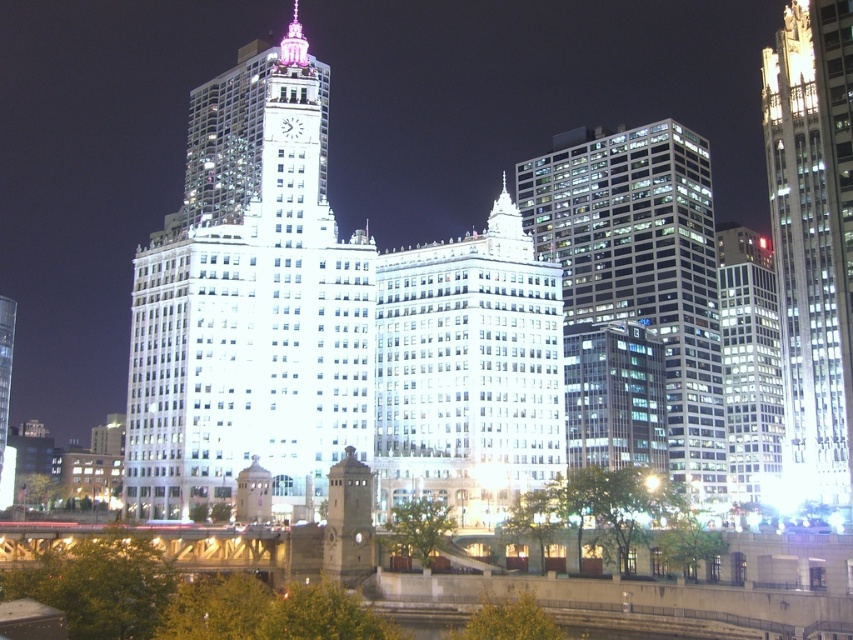
You are standing in the city looking at the illuminated building with a clock tower. There are two points marked on the building facade, one at coordinates point (350, 301) and the other at point (701, 305). Which point is closer to you?

Point (350, 301) is closer to the viewer than point (701, 305).

You are an urban planner assessing the city layout. You need to determine which building occupies more horizontal space in the city view. Based on the image, which one is wider between the white glass building at center and the shiny glass skyscraper at right?

The white glass building at center is wider than the shiny glass skyscraper at right according to the description.